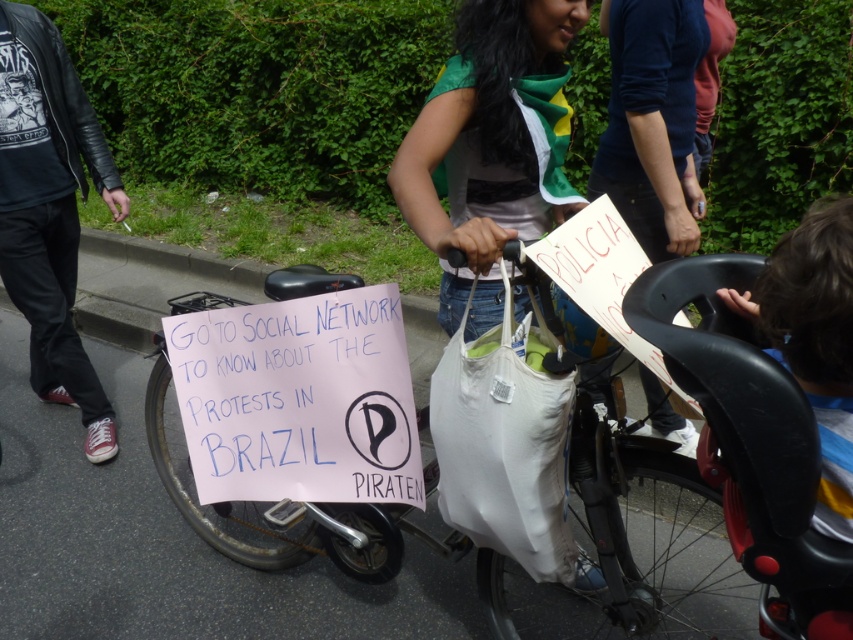
Is point (502, 186) in front of point (553, 492)?

No.

Where is `green fabric scarf at center`? green fabric scarf at center is located at coordinates (491, 147).

Locate an element on the screen. green fabric scarf at center is located at coordinates (491, 147).

Can you confirm if pink paper sign at center is positioned to the right of white fabric bag at center?

Incorrect, pink paper sign at center is not on the right side of white fabric bag at center.

What do you see at coordinates (628, 541) in the screenshot? This screenshot has height=640, width=853. I see `pink paper sign at center` at bounding box center [628, 541].

What are the coordinates of `pink paper sign at center` in the screenshot? It's located at (628, 541).

Locate an element on the screen. Image resolution: width=853 pixels, height=640 pixels. pink paper sign at center is located at coordinates (628, 541).

Who is lower down, green fabric scarf at center or black leather jacket at left?

green fabric scarf at center

Is green fabric scarf at center positioned behind black leather jacket at left?

No, green fabric scarf at center is closer to the viewer.

Does point (479, 97) come closer to viewer compared to point (84, 372)?

That is True.

This screenshot has width=853, height=640. Identify the location of green fabric scarf at center. (491, 147).